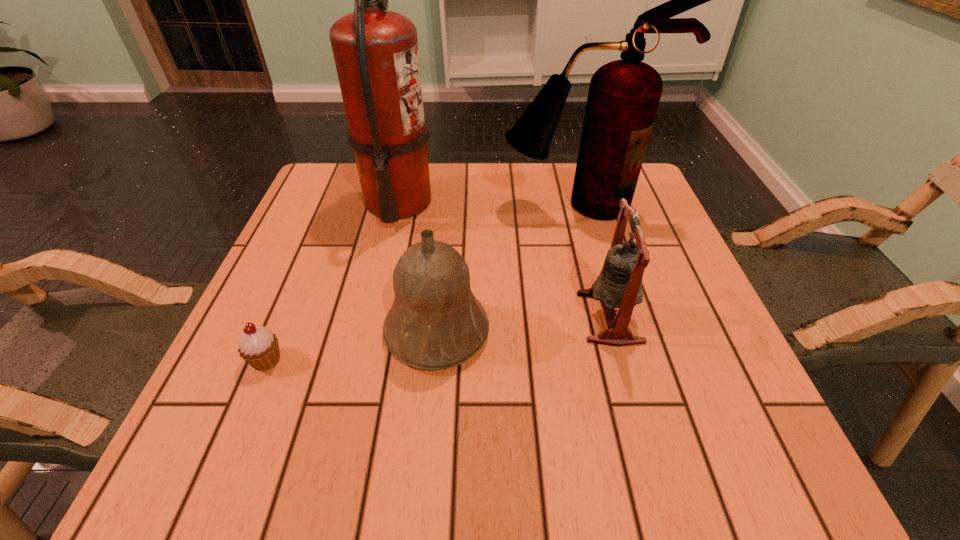
Where is `blank space at the right edge of the desktop`? Image resolution: width=960 pixels, height=540 pixels. blank space at the right edge of the desktop is located at coordinates pos(662,246).

Locate an element on the screen. vacant point located between the right bell and the left bell is located at coordinates (523, 324).

The width and height of the screenshot is (960, 540). What are the coordinates of `free spot between the left fire extinguisher and the right fire extinguisher` in the screenshot? It's located at (489, 203).

Locate an element on the screen. The image size is (960, 540). vacant space that is in between the left bell and the right fire extinguisher is located at coordinates (508, 268).

Identify the location of vacant area that lies between the right bell and the right fire extinguisher. This screenshot has width=960, height=540. (594, 261).

Image resolution: width=960 pixels, height=540 pixels. Find the location of `blank region between the left bell and the right bell`. blank region between the left bell and the right bell is located at coordinates (523, 324).

I want to click on unoccupied position between the left fire extinguisher and the leftmost object, so click(x=332, y=281).

Locate an element on the screen. Image resolution: width=960 pixels, height=540 pixels. blank region between the right fire extinguisher and the left fire extinguisher is located at coordinates (489, 203).

I want to click on empty location between the left fire extinguisher and the right bell, so click(x=504, y=260).

In order to click on object that stands as the third closest to the left bell in this screenshot , I will do `click(376, 54)`.